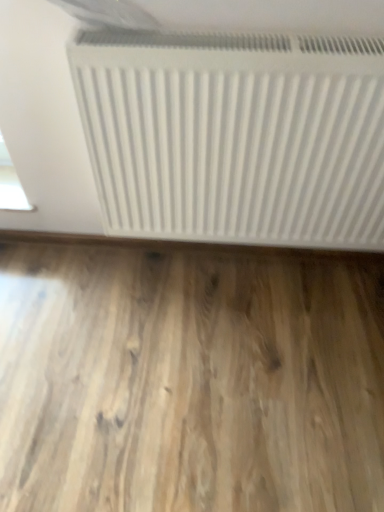
Question: Considering the positions of point (147, 266) and point (332, 203), is point (147, 266) closer or farther from the camera than point (332, 203)?

Choices:
 (A) closer
 (B) farther

Answer: (B)

Question: From a real-world perspective, relative to white matte radiator at upper center, is light brown wood flooring at bottom vertically above or below?

Choices:
 (A) below
 (B) above

Answer: (A)

Question: From the image's perspective, is light brown wood flooring at bottom located above or below white matte radiator at upper center?

Choices:
 (A) below
 (B) above

Answer: (A)

Question: Considering the positions of white matte radiator at upper center and light brown wood flooring at bottom in the image, is white matte radiator at upper center wider or thinner than light brown wood flooring at bottom?

Choices:
 (A) wide
 (B) thin

Answer: (B)

Question: From the image's perspective, is white matte radiator at upper center positioned above or below light brown wood flooring at bottom?

Choices:
 (A) below
 (B) above

Answer: (B)

Question: Is white matte radiator at upper center bigger or smaller than light brown wood flooring at bottom?

Choices:
 (A) small
 (B) big

Answer: (B)

Question: From a real-world perspective, is white matte radiator at upper center above or below light brown wood flooring at bottom?

Choices:
 (A) below
 (B) above

Answer: (B)